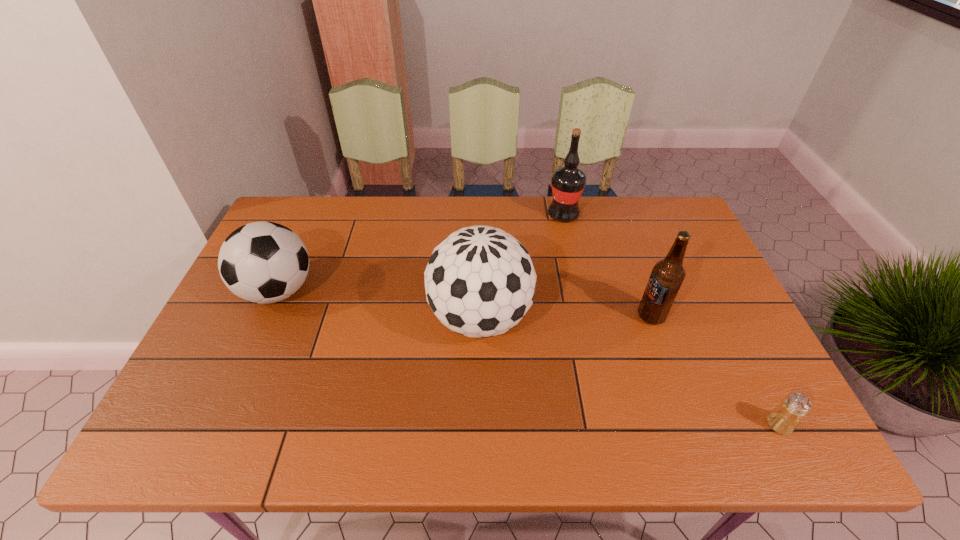
Image resolution: width=960 pixels, height=540 pixels. Identify the location of vacant area that lies between the rightmost object and the fourth object from left to right. (715, 370).

At what (x,y) coordinates should I click in order to perform the action: click on free space between the beer bottle and the shortest object. Please return your answer as a coordinate pair (x, y). This screenshot has width=960, height=540. Looking at the image, I should click on (715, 370).

Identify the location of empty location between the leftmost object and the farthest object. The image size is (960, 540). (420, 253).

I want to click on free space between the third object from right to left and the rightmost object, so click(671, 320).

Locate an element on the screen. empty space that is in between the second object from left to right and the fourth tallest object is located at coordinates (379, 305).

Where is `object that is the third closest to the taller soccer ball`? The image size is (960, 540). object that is the third closest to the taller soccer ball is located at coordinates (262, 262).

At what (x,y) coordinates should I click in order to perform the action: click on the closest object to the nearest object. Please return your answer as a coordinate pair (x, y). This screenshot has height=540, width=960. Looking at the image, I should click on (667, 276).

Where is `free space that satisfies the following two spatial constraints: 1. on the back side of the third object from right to left; 2. on the left side of the taller soccer ball`? The height and width of the screenshot is (540, 960). free space that satisfies the following two spatial constraints: 1. on the back side of the third object from right to left; 2. on the left side of the taller soccer ball is located at coordinates (480, 215).

Where is `vacant position in the image that satisfies the following two spatial constraints: 1. on the front side of the fourth tallest object; 2. on the left side of the right soccer ball`? vacant position in the image that satisfies the following two spatial constraints: 1. on the front side of the fourth tallest object; 2. on the left side of the right soccer ball is located at coordinates (266, 318).

Find the location of `vacant space that satisfies the following two spatial constraints: 1. on the front side of the left soccer ball; 2. on the left side of the saltshaker`. vacant space that satisfies the following two spatial constraints: 1. on the front side of the left soccer ball; 2. on the left side of the saltshaker is located at coordinates (219, 424).